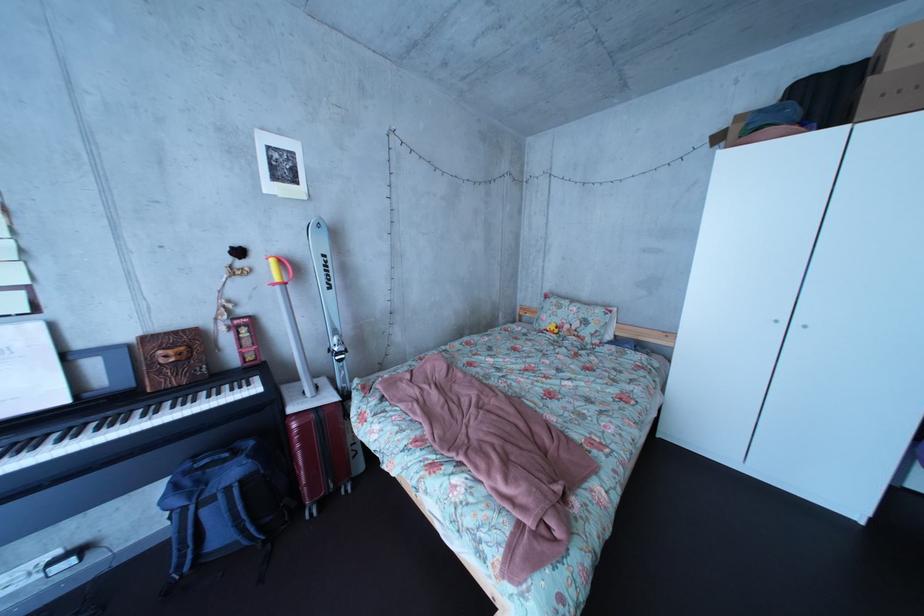
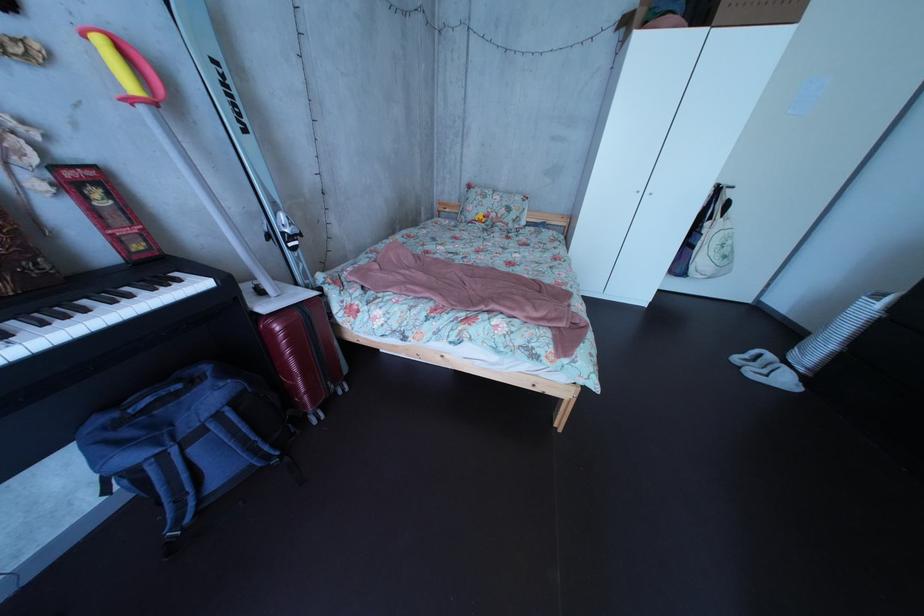
The first image is from the beginning of the video and the second image is from the end. How did the camera likely rotate when shooting the video?

The rotation direction of the camera is right-down.